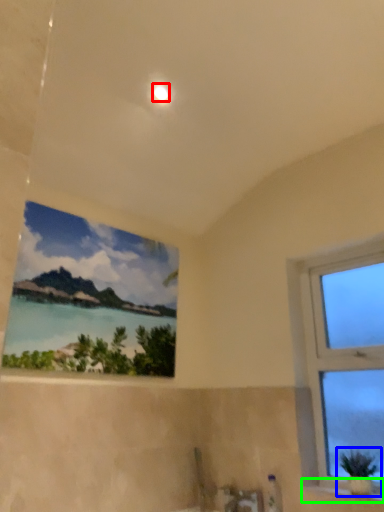
Question: Based on their relative distances, which object is nearer to light (highlighted by a red box)? Choose from houseplant (highlighted by a blue box) and window sill (highlighted by a green box).

Choices:
 (A) houseplant
 (B) window sill

Answer: (A)